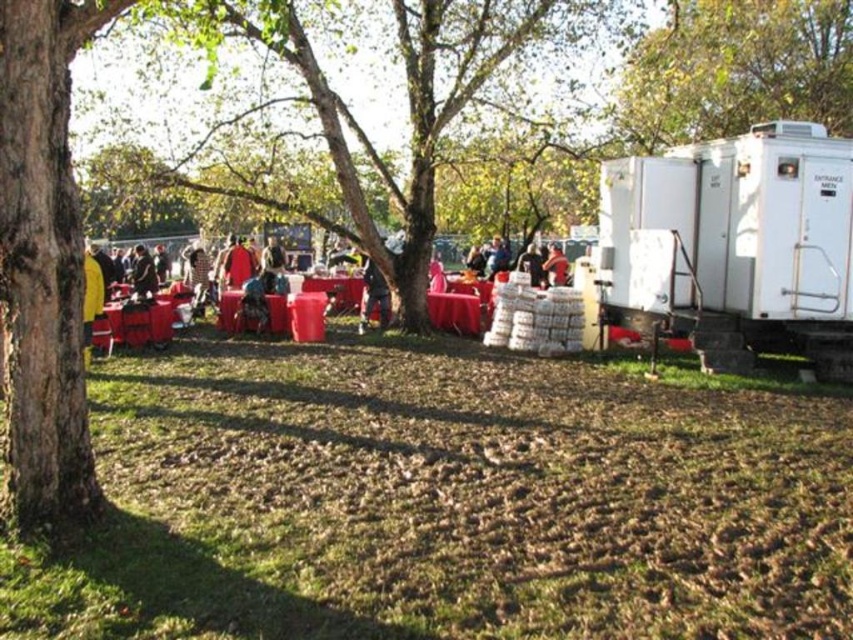
Consider the image. You are a photographer standing at the edge of the park and want to take a photo of the brown soil at lower center and the matte plastic table at center. Which object will appear larger in the photo?

The brown soil at lower center will appear larger in the photo because it is closer to the viewer than the matte plastic table at center.

You are a photographer trying to capture a photo of the dark blue jeans at center and the matte red coat at center. Since you want both subjects to be in focus, which one should you focus on first to ensure the other is also in focus?

You should focus on the dark blue jeans at center first because it is taller than the matte red coat at center, ensuring the depth of field will cover both subjects.

You are planning to place a small potted plant on the ground in this outdoor setting. The potted plant requires a spot that has enough space and is not covered by the dark blue jeans at center. Based on the scene, can you determine if the brown soil at lower center has enough space for the plant?

The brown soil at lower center is larger in size than the dark blue jeans at center, so there is sufficient space for the potted plant on the brown soil at lower center.